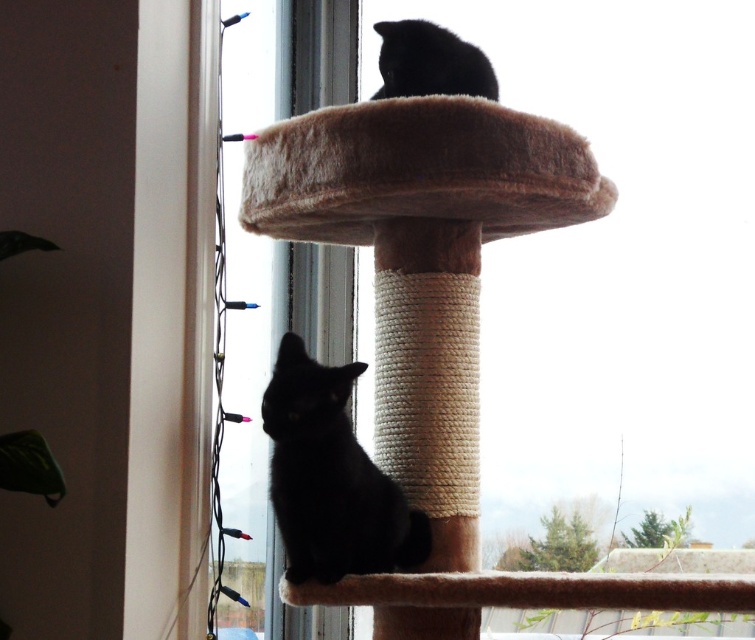
Is brown fuzzy cat bed at upper center bigger than black matte cat at lower center?

Correct, brown fuzzy cat bed at upper center is larger in size than black matte cat at lower center.

Between brown fuzzy cat bed at upper center and black matte cat at lower center, which one appears on the left side from the viewer's perspective?

black matte cat at lower center is more to the left.

Where is `brown fuzzy cat bed at upper center`? The image size is (755, 640). brown fuzzy cat bed at upper center is located at coordinates (418, 170).

The image size is (755, 640). What are the coordinates of `brown fuzzy cat bed at upper center` in the screenshot? It's located at (418, 170).

Can you confirm if black matte cat at lower center is smaller than black fur cat at upper center?

Actually, black matte cat at lower center might be larger than black fur cat at upper center.

Image resolution: width=755 pixels, height=640 pixels. What do you see at coordinates (331, 477) in the screenshot?
I see `black matte cat at lower center` at bounding box center [331, 477].

Who is more forward, (x=365, y=518) or (x=408, y=33)?

Positioned in front is point (x=365, y=518).

The image size is (755, 640). I want to click on black matte cat at lower center, so click(331, 477).

Who is more forward, [495,163] or [439,81]?

Point [495,163] is in front.

Who is higher up, brown fuzzy cat bed at upper center or black fur cat at upper center?

black fur cat at upper center is above.

Who is more forward, (x=284, y=228) or (x=408, y=81)?

Point (x=408, y=81) is more forward.

Where is `brown fuzzy cat bed at upper center`? brown fuzzy cat bed at upper center is located at coordinates (418, 170).